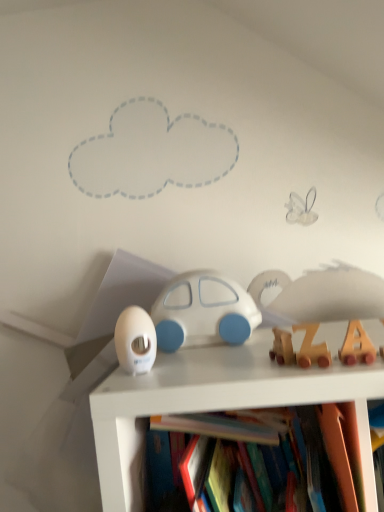
Measure the distance between point (x=147, y=317) and camera.

They are 29.21 inches apart.

What do you see at coordinates (203, 312) in the screenshot? I see `white matte car at center, the 4th toy positioned from the front` at bounding box center [203, 312].

The height and width of the screenshot is (512, 384). What do you see at coordinates (300, 348) in the screenshot?
I see `wooden train at right, acting as the 2th toy starting from the right` at bounding box center [300, 348].

This screenshot has height=512, width=384. What are the coordinates of `wooden letter blocks at center-right, which appears as the 4th toy when viewed from the left` in the screenshot? It's located at (356, 345).

Who is bigger, wooden train at right, acting as the 2th toy starting from the right, or white glossy egg at center, the 1th toy positioned from the left?

Bigger between the two is white glossy egg at center, the 1th toy positioned from the left.

Is wooden train at right, arranged as the third toy when viewed from the left, positioned with its back to white glossy egg at center, arranged as the 2th toy when viewed from the back?

wooden train at right, arranged as the third toy when viewed from the left, is not turned away from white glossy egg at center, arranged as the 2th toy when viewed from the back.

Which toy is the 1st one when counting from the front of the white glossy egg at center, arranged as the 2th toy when viewed from the back? Please provide its 2D coordinates.

[(300, 348)]

Based on the photo, would you say white glossy egg at center, placed as the third toy when sorted from front to back, is outside wooden letter blocks at center-right, placed as the 1th toy when sorted from front to back?

Yes, white glossy egg at center, placed as the third toy when sorted from front to back, is not within wooden letter blocks at center-right, placed as the 1th toy when sorted from front to back.

Can you confirm if white glossy egg at center, placed as the third toy when sorted from front to back, is taller than wooden letter blocks at center-right, the 1th toy positioned from the right?

Correct, white glossy egg at center, placed as the third toy when sorted from front to back, is much taller as wooden letter blocks at center-right, the 1th toy positioned from the right.

From the image's perspective, which object appears higher, white glossy egg at center, arranged as the 2th toy when viewed from the back, or wooden letter blocks at center-right, placed as the 1th toy when sorted from front to back?

wooden letter blocks at center-right, placed as the 1th toy when sorted from front to back, from the image's perspective.

Which object is further away from the camera taking this photo, white glossy egg at center, the 1th toy positioned from the left, or wooden train at right, the 3th toy from the back?

white glossy egg at center, the 1th toy positioned from the left, is more distant.

Could you tell me if white glossy egg at center, placed as the third toy when sorted from front to back, is turned towards wooden train at right, acting as the 2th toy starting from the right?

No, white glossy egg at center, placed as the third toy when sorted from front to back, does not turn towards wooden train at right, acting as the 2th toy starting from the right.

From the image's perspective, relative to wooden train at right, the 3th toy from the back, is white glossy egg at center, arranged as the 2th toy when viewed from the back, above or below?

white glossy egg at center, arranged as the 2th toy when viewed from the back, is below wooden train at right, the 3th toy from the back.

Does point (154, 354) lie behind point (314, 357)?

Yes, point (154, 354) is behind point (314, 357).

Does wooden letter blocks at center-right, the 1th toy positioned from the right, have a lesser width compared to wooden train at right, acting as the 2th toy starting from the right?

Indeed, wooden letter blocks at center-right, the 1th toy positioned from the right, has a lesser width compared to wooden train at right, acting as the 2th toy starting from the right.

Is wooden letter blocks at center-right, the 1th toy positioned from the right, to the right of wooden train at right, the 2th toy positioned from the front, from the viewer's perspective?

Correct, you'll find wooden letter blocks at center-right, the 1th toy positioned from the right, to the right of wooden train at right, the 2th toy positioned from the front.

Are wooden letter blocks at center-right, the 1th toy positioned from the right, and wooden train at right, the 2th toy positioned from the front, making contact?

Yes.

Between point (357, 327) and point (313, 349), which one is positioned in front?

Point (313, 349)

Can you confirm if white matte car at center, the first toy viewed from the back, is bigger than wooden letter blocks at center-right, the 1th toy positioned from the right?

Indeed, white matte car at center, the first toy viewed from the back, has a larger size compared to wooden letter blocks at center-right, the 1th toy positioned from the right.

Which object is more forward, white matte car at center, the 4th toy positioned from the front, or wooden letter blocks at center-right, which ranks as the fourth toy in back-to-front order?

wooden letter blocks at center-right, which ranks as the fourth toy in back-to-front order, is more forward.

Is there a large distance between white matte car at center, the 4th toy positioned from the front, and wooden letter blocks at center-right, which appears as the 4th toy when viewed from the left?

No.

Consider the image. From a real-world perspective, is white matte car at center, the first toy viewed from the back, located beneath wooden letter blocks at center-right, placed as the 1th toy when sorted from front to back?

No, from a real-world perspective, white matte car at center, the first toy viewed from the back, is not under wooden letter blocks at center-right, placed as the 1th toy when sorted from front to back.

Is white matte car at center, acting as the 3th toy starting from the right, at the right side of white glossy egg at center, acting as the 4th toy starting from the right?

Indeed, white matte car at center, acting as the 3th toy starting from the right, is positioned on the right side of white glossy egg at center, acting as the 4th toy starting from the right.

From the image's perspective, which toy is the 3rd one below the white matte car at center, the 4th toy positioned from the front? Please provide its 2D coordinates.

[(135, 340)]

Is white matte car at center, acting as the 3th toy starting from the right, placed right next to white glossy egg at center, placed as the third toy when sorted from front to back?

They are not placed beside each other.

Which is more distant, (x=157, y=315) or (x=151, y=367)?

The point (x=157, y=315) is more distant.

Is white matte car at center, the 4th toy positioned from the front, far from wooden train at right, acting as the 2th toy starting from the right?

That's not correct — white matte car at center, the 4th toy positioned from the front, is a little close to wooden train at right, acting as the 2th toy starting from the right.

Does white matte car at center, arranged as the 2th toy when viewed from the left, have a smaller size compared to wooden train at right, arranged as the third toy when viewed from the left?

No.

Is white matte car at center, the first toy viewed from the back, oriented towards wooden train at right, the 2th toy positioned from the front?

Yes, white matte car at center, the first toy viewed from the back, is turned towards wooden train at right, the 2th toy positioned from the front.

Considering the relative sizes of white matte car at center, arranged as the 2th toy when viewed from the left, and wooden train at right, arranged as the third toy when viewed from the left, in the image provided, is white matte car at center, arranged as the 2th toy when viewed from the left, shorter than wooden train at right, arranged as the third toy when viewed from the left,?

No, white matte car at center, arranged as the 2th toy when viewed from the left, is not shorter than wooden train at right, arranged as the third toy when viewed from the left.

Which toy is the 1st one when counting from the front of the white glossy egg at center, placed as the third toy when sorted from front to back? Please provide its 2D coordinates.

[(300, 348)]

Where is `toy that is the 1st one below the white glossy egg at center, arranged as the 2th toy when viewed from the back (from a real-world perspective)`? This screenshot has width=384, height=512. toy that is the 1st one below the white glossy egg at center, arranged as the 2th toy when viewed from the back (from a real-world perspective) is located at coordinates (356, 345).

Estimate the real-world distances between objects in this image. Which object is closer to white glossy egg at center, arranged as the 2th toy when viewed from the back, wooden train at right, the 2th toy positioned from the front, or white matte car at center, the first toy viewed from the back?

Among the two, white matte car at center, the first toy viewed from the back, is located nearer to white glossy egg at center, arranged as the 2th toy when viewed from the back.

Estimate the real-world distances between objects in this image. Which object is closer to wooden train at right, the 3th toy from the back, white matte car at center, the first toy viewed from the back, or wooden letter blocks at center-right, which ranks as the fourth toy in back-to-front order?

Based on the image, wooden letter blocks at center-right, which ranks as the fourth toy in back-to-front order, appears to be nearer to wooden train at right, the 3th toy from the back.

Which object lies nearer to the anchor point wooden letter blocks at center-right, which appears as the 4th toy when viewed from the left, white matte car at center, acting as the 3th toy starting from the right, or white glossy egg at center, placed as the third toy when sorted from front to back?

Based on the image, white matte car at center, acting as the 3th toy starting from the right, appears to be nearer to wooden letter blocks at center-right, which appears as the 4th toy when viewed from the left.

From the image, which object appears to be nearer to white glossy egg at center, placed as the third toy when sorted from front to back, wooden train at right, acting as the 2th toy starting from the right, or wooden letter blocks at center-right, which appears as the 4th toy when viewed from the left?

wooden train at right, acting as the 2th toy starting from the right, lies closer to white glossy egg at center, placed as the third toy when sorted from front to back, than the other object.

Considering their positions, is wooden letter blocks at center-right, the 1th toy positioned from the right, positioned further to white glossy egg at center, acting as the 4th toy starting from the right, than wooden train at right, the 3th toy from the back?

wooden letter blocks at center-right, the 1th toy positioned from the right, lies further to white glossy egg at center, acting as the 4th toy starting from the right, than the other object.

From the image, which object appears to be farther from white glossy egg at center, the 1th toy positioned from the left, wooden letter blocks at center-right, placed as the 1th toy when sorted from front to back, or white matte car at center, acting as the 3th toy starting from the right?

The object further to white glossy egg at center, the 1th toy positioned from the left, is wooden letter blocks at center-right, placed as the 1th toy when sorted from front to back.

Which object lies nearer to the anchor point wooden letter blocks at center-right, which appears as the 4th toy when viewed from the left, wooden train at right, acting as the 2th toy starting from the right, or white glossy egg at center, the 1th toy positioned from the left?

Among the two, wooden train at right, acting as the 2th toy starting from the right, is located nearer to wooden letter blocks at center-right, which appears as the 4th toy when viewed from the left.

Which object lies nearer to the anchor point white matte car at center, the 4th toy positioned from the front, white glossy egg at center, the 1th toy positioned from the left, or wooden train at right, the 3th toy from the back?

white glossy egg at center, the 1th toy positioned from the left, is positioned closer to the anchor white matte car at center, the 4th toy positioned from the front.

You are a GUI agent. You are given a task and a screenshot of the screen. Output one action in this format:
    pyautogui.click(x=<x>, y=<y>)
    Task: Click on the toy between white glossy egg at center, placed as the third toy when sorted from front to back, and wooden train at right, the 2th toy positioned from the front
    Image resolution: width=384 pixels, height=512 pixels.
    Given the screenshot: What is the action you would take?
    pyautogui.click(x=203, y=312)